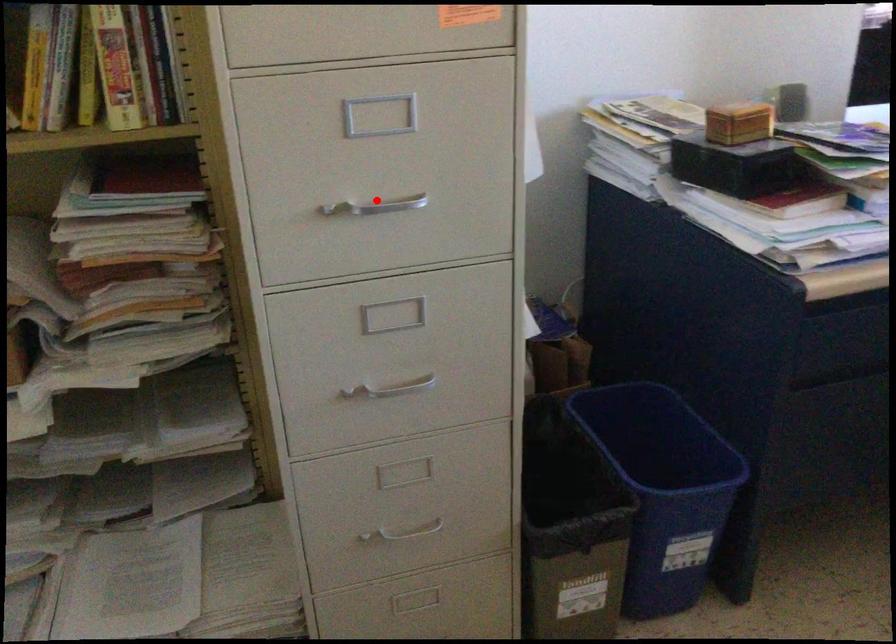
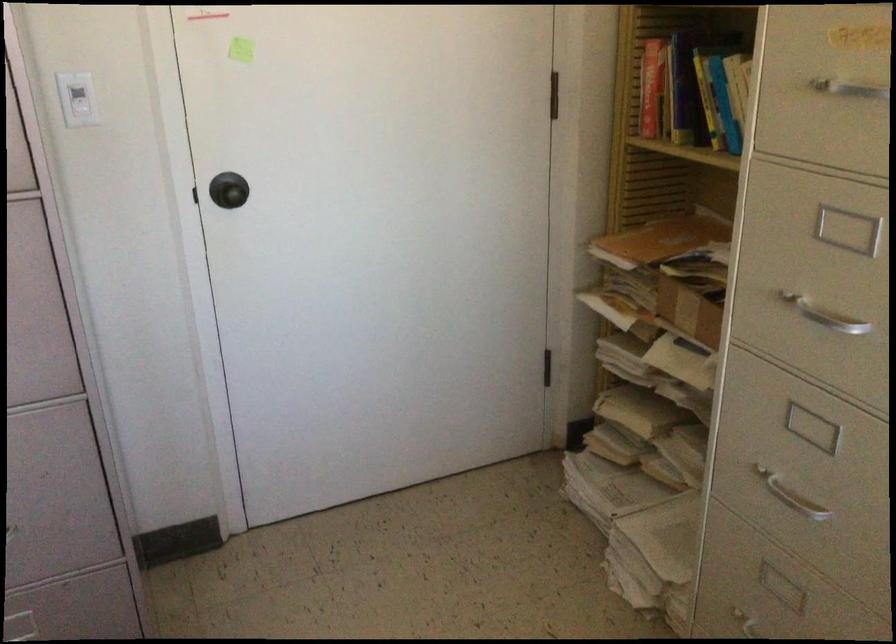
The point at the highlighted location is marked in the first image. Where is the corresponding point in the second image?

(824, 315)